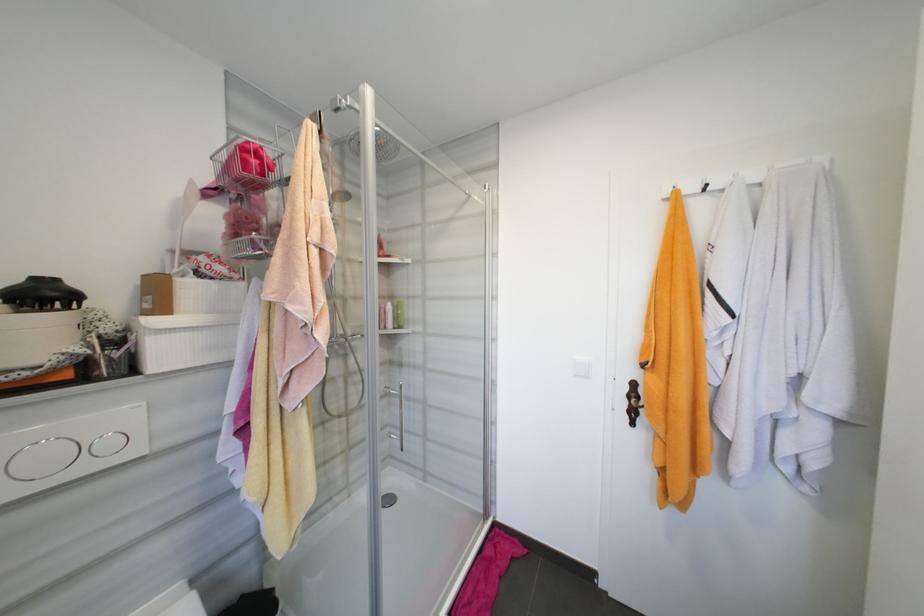
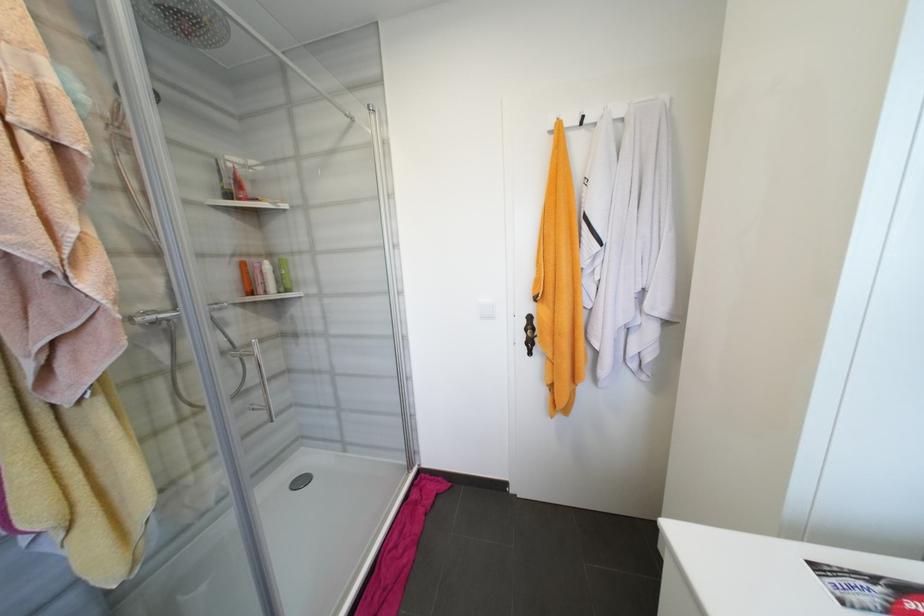
Question: Based on the continuous images, in which direction is the camera rotating? Reply with the corresponding letter.

Choices:
 (A) Left
 (B) Right
 (C) Up
 (D) Down

Answer: (B)